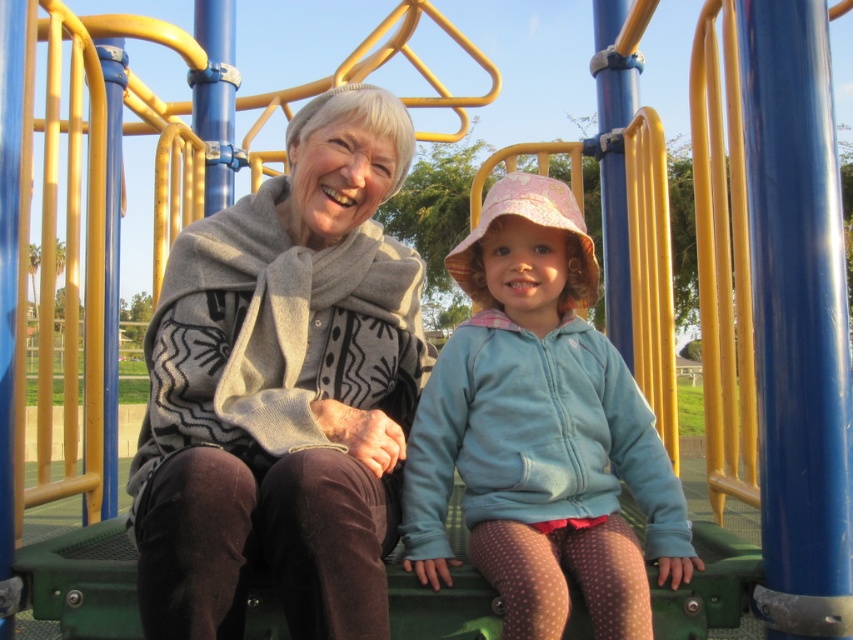
Who is higher up, knitted gray scarf at center or light blue fleece jacket at center?

knitted gray scarf at center is higher up.

Can you confirm if knitted gray scarf at center is shorter than light blue fleece jacket at center?

No.

Who is more distant from viewer, (x=241, y=445) or (x=553, y=611)?

The point (x=241, y=445) is more distant.

What are the coordinates of `knitted gray scarf at center` in the screenshot? It's located at (283, 388).